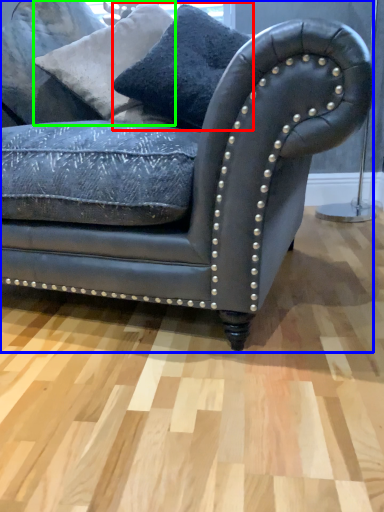
Question: Which object is positioned farthest from pillow (highlighted by a red box)? Select from studio couch (highlighted by a blue box) and pillow (highlighted by a green box).

Choices:
 (A) studio couch
 (B) pillow

Answer: (A)